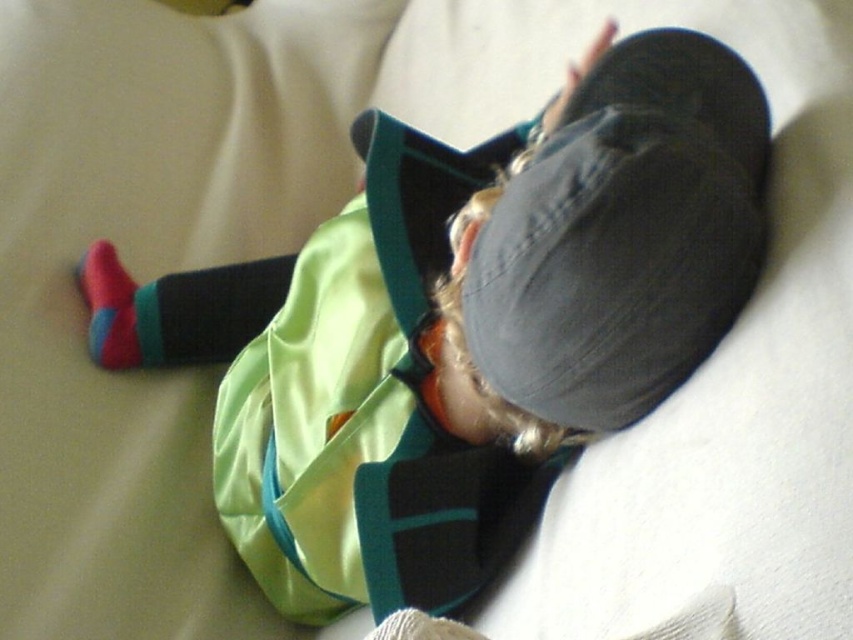
You are a photographer setting up a shoot in the given scene. You need to place a small prop between the green fabric safety vest at center and the red cotton sock at lower left. Based on their positions, where should you place the prop to ensure it is between them?

The green fabric safety vest at center is to the right of the red cotton sock at lower left, so placing the prop between them would require positioning it to the right of the red cotton sock at lower left and to the left of the green fabric safety vest at center.

You are a photographer adjusting your camera settings. You want to ensure the green fabric safety vest at center is in focus. What is the minimum distance you should set your camera focus to capture it clearly?

The minimum distance you should set your camera focus to capture the green fabric safety vest at center clearly is 30.64 inches, as it is positioned exactly that far from the camera.

You are a delivery person who just arrived at a house. You see a green fabric safety vest at center on the floor. Where should you place the safety vest to ensure it is easily accessible but not in the way of the child lying on the bed?

The green fabric safety vest at center should be placed in a nearby drawer or on a shelf to keep it accessible yet out of the child